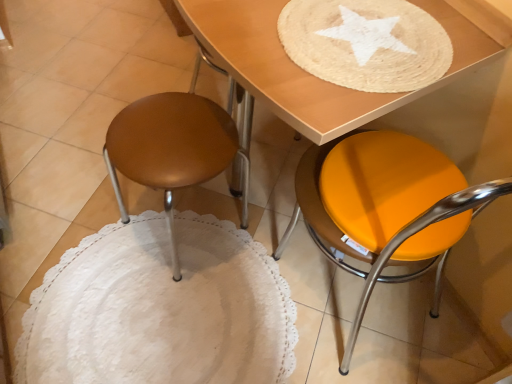
What is the approximate width of orange matte stool at lower right?

It is 45.56 centimeters.

Describe the element at coordinates (318, 78) in the screenshot. This screenshot has height=384, width=512. I see `wooden table at upper center` at that location.

At what (x,y) coordinates should I click in order to perform the action: click on matte brown stool at left. Please return your answer as a coordinate pair (x, y). Looking at the image, I should click on (172, 149).

Is wooden table at upper center oriented towards matte brown stool at left?

No, wooden table at upper center does not turn towards matte brown stool at left.

Is wooden table at upper center next to matte brown stool at left?

wooden table at upper center and matte brown stool at left are not in contact.

Who is taller, wooden table at upper center or matte brown stool at left?

matte brown stool at left is taller.

From a real-world perspective, is wooden table at upper center physically below matte brown stool at left?

Actually, wooden table at upper center is physically above matte brown stool at left in the real world.

Does point (192, 120) come behind point (451, 33)?

Yes, it is behind point (451, 33).

Considering the sizes of objects matte brown stool at left and wooden table at upper center in the image provided, who is bigger, matte brown stool at left or wooden table at upper center?

Bigger between the two is matte brown stool at left.

Considering the relative sizes of matte brown stool at left and wooden table at upper center in the image provided, is matte brown stool at left wider than wooden table at upper center?

Correct, the width of matte brown stool at left exceeds that of wooden table at upper center.

Is wooden table at upper center located within matte brown stool at left?

Definitely not — wooden table at upper center is not inside matte brown stool at left.

Measure the distance between orange matte stool at lower right and wooden table at upper center.

orange matte stool at lower right is 10.79 inches away from wooden table at upper center.

Could wooden table at upper center be considered to be inside orange matte stool at lower right?

That's correct, wooden table at upper center is inside orange matte stool at lower right.

Is the position of orange matte stool at lower right more distant than that of wooden table at upper center?

No, orange matte stool at lower right is closer to the viewer.

Is orange matte stool at lower right taller than wooden table at upper center?

Yes, orange matte stool at lower right is taller than wooden table at upper center.

Is point (251, 52) closer or farther from the camera than point (423, 153)?

Point (251, 52) appears to be closer to the viewer than point (423, 153).

This screenshot has width=512, height=384. I want to click on table above the orange matte stool at lower right (from a real-world perspective), so click(318, 78).

Considering the relative positions of wooden table at upper center and orange matte stool at lower right in the image provided, is wooden table at upper center in front of orange matte stool at lower right?

No, wooden table at upper center is behind orange matte stool at lower right.

Is orange matte stool at lower right wider than matte brown stool at left?

Correct, the width of orange matte stool at lower right exceeds that of matte brown stool at left.

Is orange matte stool at lower right smaller than matte brown stool at left?

Actually, orange matte stool at lower right might be larger than matte brown stool at left.

From the image's perspective, which one is positioned lower, orange matte stool at lower right or matte brown stool at left?

orange matte stool at lower right is shown below in the image.

How distant is orange matte stool at lower right from matte brown stool at left?

The distance of orange matte stool at lower right from matte brown stool at left is 15.08 inches.

Find the location of a particular element. stool above the orange matte stool at lower right (from the image's perspective) is located at coordinates (172, 149).

Who is taller, matte brown stool at left or orange matte stool at lower right?

orange matte stool at lower right is taller.

Could orange matte stool at lower right be considered to be inside matte brown stool at left?

Actually, orange matte stool at lower right is outside matte brown stool at left.

Between matte brown stool at left and orange matte stool at lower right, which one appears on the left side from the viewer's perspective?

Positioned to the left is matte brown stool at left.

Find the location of a particular element. This screenshot has width=512, height=384. table above the matte brown stool at left (from the image's perspective) is located at coordinates (318, 78).

At what (x,y) coordinates should I click in order to perform the action: click on table on the right of matte brown stool at left. Please return your answer as a coordinate pair (x, y). Looking at the image, I should click on (318, 78).

From the image, which object appears to be nearer to matte brown stool at left, wooden table at upper center or orange matte stool at lower right?

The object closer to matte brown stool at left is wooden table at upper center.

Which object lies nearer to the anchor point orange matte stool at lower right, wooden table at upper center or matte brown stool at left?

Based on the image, wooden table at upper center appears to be nearer to orange matte stool at lower right.

Looking at the image, which one is located closer to wooden table at upper center, matte brown stool at left or orange matte stool at lower right?

Based on the image, orange matte stool at lower right appears to be nearer to wooden table at upper center.

From the image, which object appears to be nearer to orange matte stool at lower right, matte brown stool at left or wooden table at upper center?

wooden table at upper center is closer to orange matte stool at lower right.

Estimate the real-world distances between objects in this image. Which object is further from wooden table at upper center, orange matte stool at lower right or matte brown stool at left?

Based on the image, matte brown stool at left appears to be further to wooden table at upper center.

From the image, which object appears to be nearer to matte brown stool at left, orange matte stool at lower right or wooden table at upper center?

wooden table at upper center is closer to matte brown stool at left.

The image size is (512, 384). I want to click on table situated between matte brown stool at left and orange matte stool at lower right from left to right, so click(x=318, y=78).